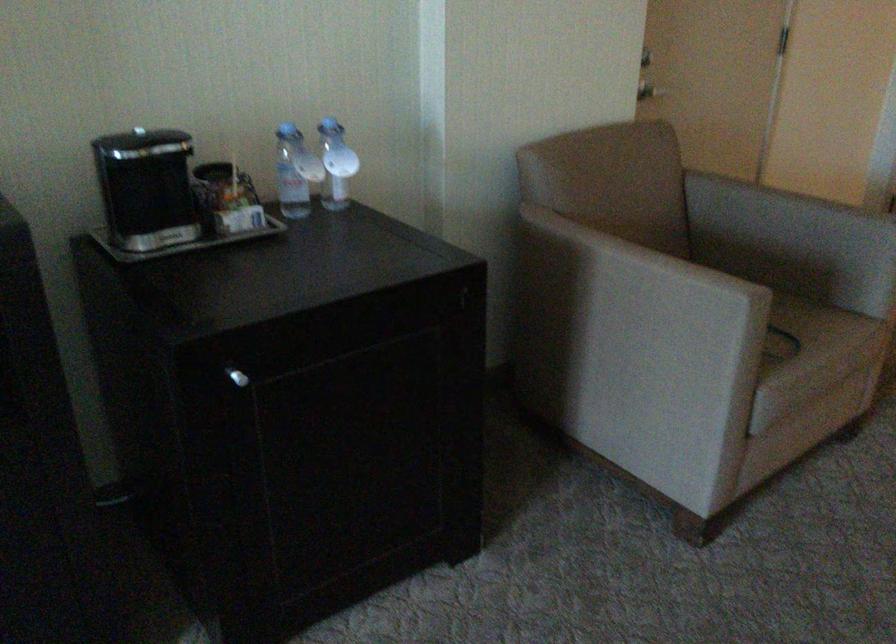
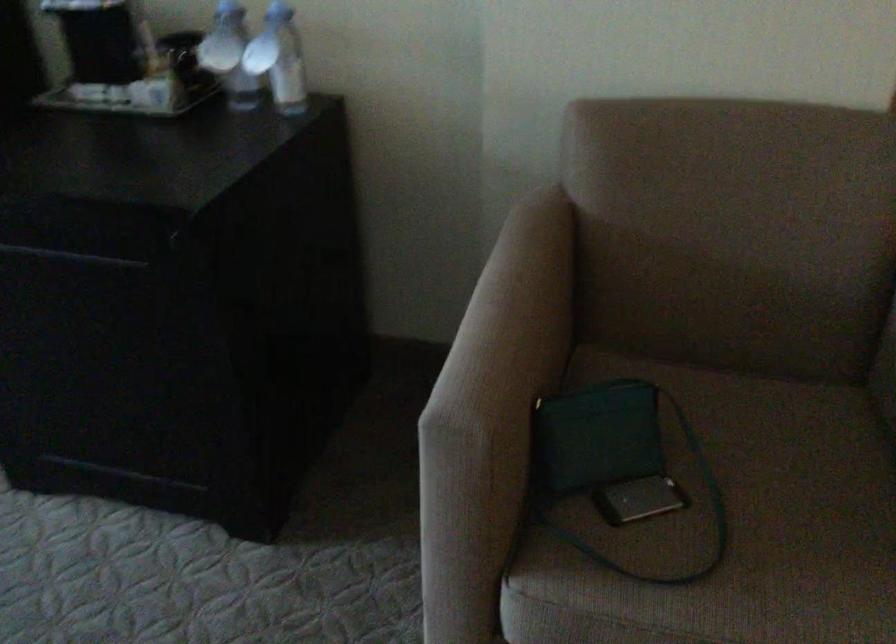
In the second image, find the point that corresponds to point (774, 322) in the first image.

(729, 526)